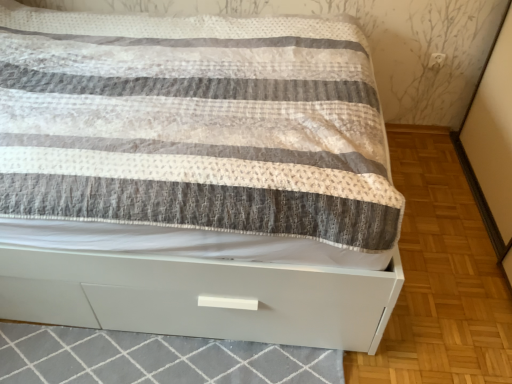
Question: Considering the positions of white glossy bed at center and white glossy drawer at lower center in the image, is white glossy bed at center wider or thinner than white glossy drawer at lower center?

Choices:
 (A) thin
 (B) wide

Answer: (B)

Question: In the image, is white glossy bed at center positioned in front of or behind white glossy drawer at lower center?

Choices:
 (A) behind
 (B) front

Answer: (B)

Question: Based on their sizes in the image, would you say white glossy bed at center is bigger or smaller than white glossy drawer at lower center?

Choices:
 (A) big
 (B) small

Answer: (A)

Question: From the image's perspective, relative to white glossy bed at center, is white glossy drawer at lower center above or below?

Choices:
 (A) below
 (B) above

Answer: (A)

Question: Considering the positions of white glossy drawer at lower center and white glossy bed at center in the image, is white glossy drawer at lower center bigger or smaller than white glossy bed at center?

Choices:
 (A) big
 (B) small

Answer: (B)

Question: Considering their positions, is white glossy drawer at lower center located in front of or behind white glossy bed at center?

Choices:
 (A) front
 (B) behind

Answer: (B)

Question: Would you say white glossy drawer at lower center is to the left or to the right of white glossy bed at center in the picture?

Choices:
 (A) right
 (B) left

Answer: (A)